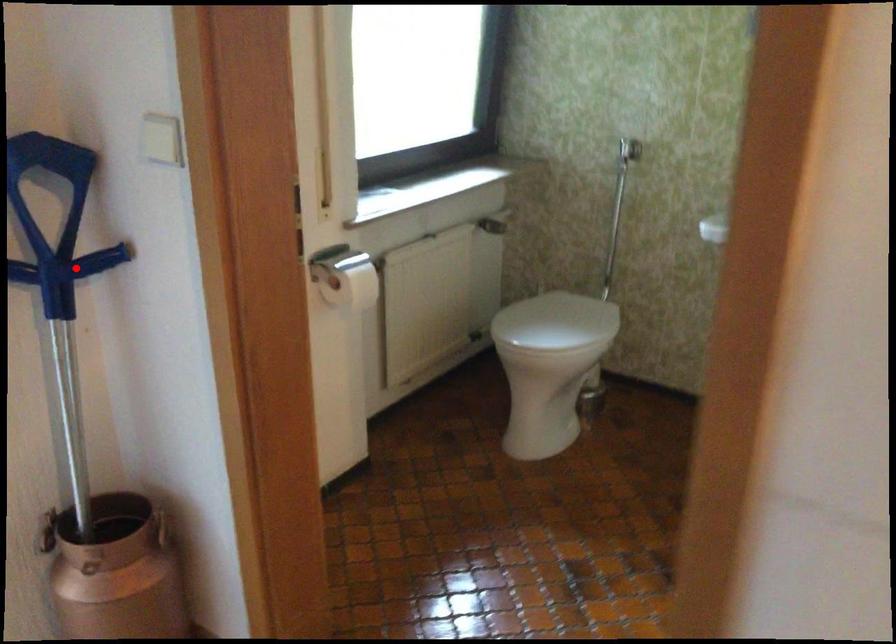
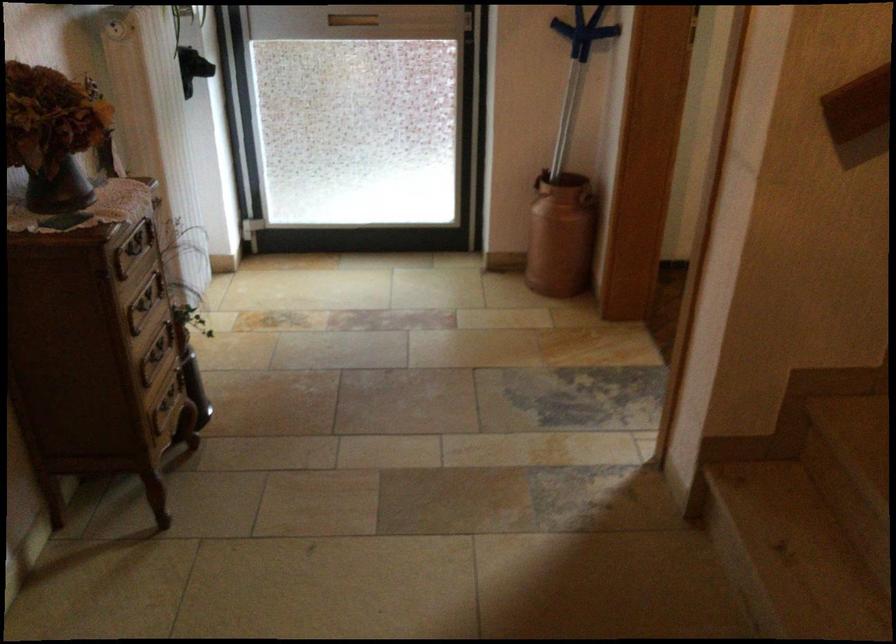
Question: I am providing you with two images of the same scene from different viewpoints. In image1, a red point is highlighted. Considering the same 3D point in image2, which of the following is correct?

Choices:
 (A) It is closer
 (B) It is farther

Answer: (B)